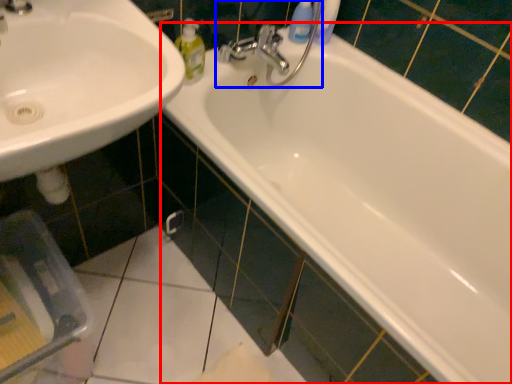
Question: Which object appears farthest to the camera in this image, bathtub (highlighted by a red box) or plumbing fixture (highlighted by a blue box)?

Choices:
 (A) bathtub
 (B) plumbing fixture

Answer: (B)